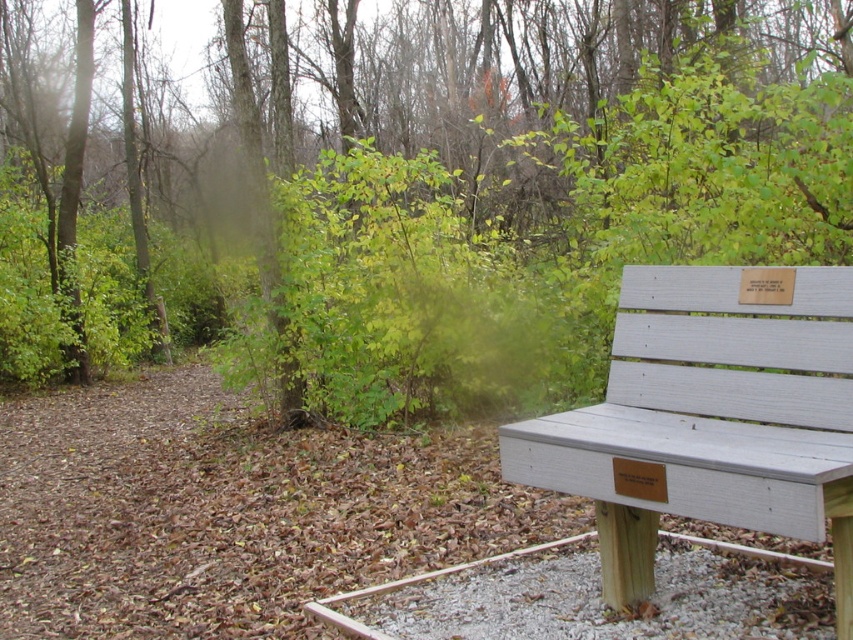
You are a park visitor who wants to take a photo of the white painted wood bench at right without the green leafy tree at upper right appearing in the background. Is it possible to position yourself in a way that the bench is visible but the tree is not?

The green leafy tree at upper right is much taller than the white painted wood bench at right, so if you position yourself far enough away from the bench and angle your camera downward, you can frame the shot so the bench is visible while the tree remains out of the frame.

You are standing at the wooden bench with light gray slats and a plaque in the foreground. Looking towards the upper right corner of the image, which object is located at the coordinates point (424, 192)?

The point (424, 192) corresponds to the green leafy tree at upper right.